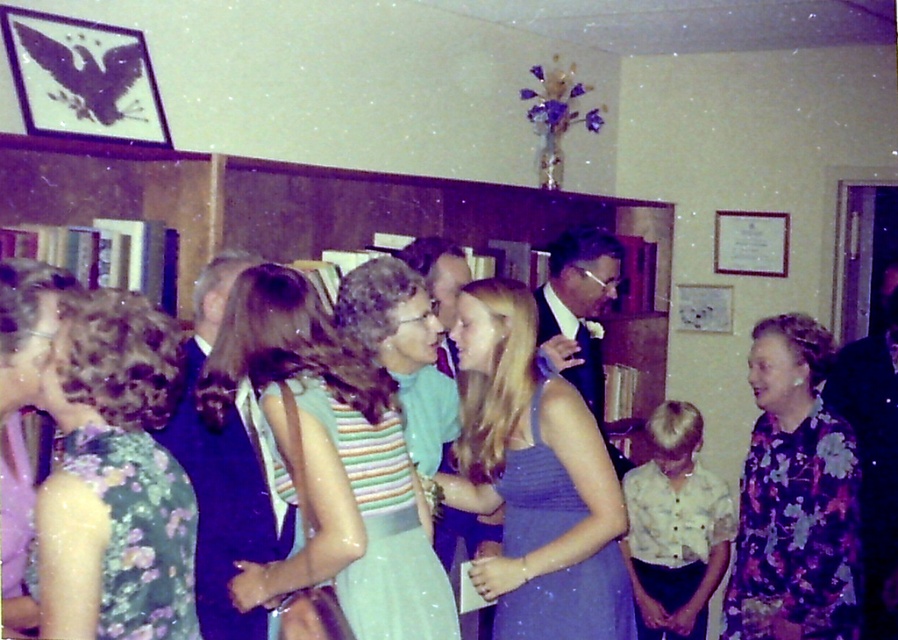
Can you confirm if floral fabric dress at left is shorter than matte blue dress at center?

Correct, floral fabric dress at left is not as tall as matte blue dress at center.

Can you confirm if floral fabric dress at left is wider than matte blue dress at center?

No.

Describe the element at coordinates (113, 477) in the screenshot. This screenshot has width=898, height=640. I see `floral fabric dress at left` at that location.

Locate an element on the screen. The width and height of the screenshot is (898, 640). floral fabric dress at left is located at coordinates (113, 477).

Is floral fabric dress at left below satin purple dress at center?

Incorrect, floral fabric dress at left is not positioned below satin purple dress at center.

Who is lower down, floral fabric dress at left or satin purple dress at center?

satin purple dress at center

Does point (29, 572) come in front of point (600, 582)?

Yes, it is.

Locate an element on the screen. floral fabric dress at left is located at coordinates (113, 477).

Does yellow cotton shirt at lower right have a greater height compared to satin purple dress at center?

Yes, yellow cotton shirt at lower right is taller than satin purple dress at center.

Which is above, yellow cotton shirt at lower right or satin purple dress at center?

Positioned higher is satin purple dress at center.

Who is more distant from viewer, (x=692, y=472) or (x=632, y=627)?

The point (x=692, y=472) is more distant.

Identify the location of yellow cotton shirt at lower right. (675, 528).